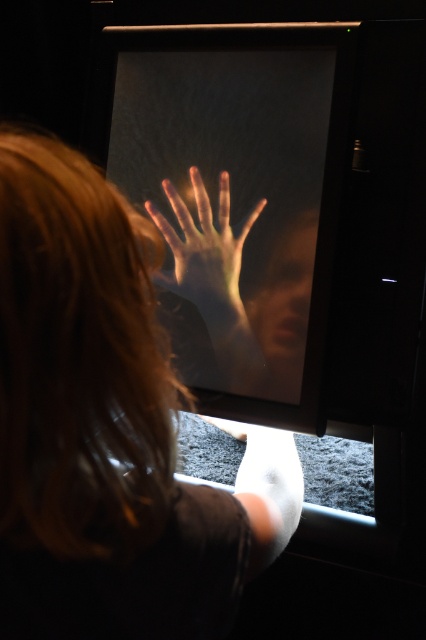
Which is in front, point (230, 314) or point (279, 252)?

Point (279, 252) is more forward.

Is translucent flesh at center to the right of smooth skin face at center from the viewer's perspective?

No, translucent flesh at center is not to the right of smooth skin face at center.

You are a GUI agent. You are given a task and a screenshot of the screen. Output one action in this format:
    pyautogui.click(x=<x>, y=<y>)
    Task: Click on the translucent flesh at center
    Image resolution: width=426 pixels, height=640 pixels.
    Given the screenshot: What is the action you would take?
    pyautogui.click(x=204, y=248)

In the scene shown: Which is more to the left, smooth skin hand at center or transparent glass screen at center?

Positioned to the left is smooth skin hand at center.

Which is in front, point (235, 577) or point (209, 141)?

Point (235, 577) is more forward.

Which is behind, point (5, 168) or point (307, 209)?

The point (307, 209) is behind.

In order to click on smooth skin hand at center in this screenshot , I will do `click(108, 428)`.

Who is taller, smooth skin hand at center or translucent flesh at center?

smooth skin hand at center

Can you confirm if smooth skin hand at center is positioned to the right of translucent flesh at center?

Incorrect, smooth skin hand at center is not on the right side of translucent flesh at center.

Does point (236, 600) come farther from viewer compared to point (157, 221)?

No, (236, 600) is closer to viewer.

At what (x,y) coordinates should I click in order to perform the action: click on smooth skin hand at center. Please return your answer as a coordinate pair (x, y). Looking at the image, I should click on (108, 428).